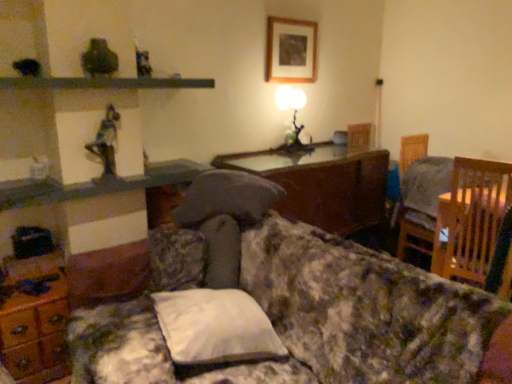
Question: Is metallic statue at upper left positioned with its back to wooden chair at right?

Choices:
 (A) yes
 (B) no

Answer: (B)

Question: Is the depth of metallic statue at upper left less than that of wooden chair at right?

Choices:
 (A) yes
 (B) no

Answer: (A)

Question: From the image's perspective, is metallic statue at upper left located above wooden chair at right?

Choices:
 (A) yes
 (B) no

Answer: (A)

Question: Is metallic statue at upper left further to the viewer compared to wooden chair at right?

Choices:
 (A) no
 (B) yes

Answer: (A)

Question: Could you tell me if metallic statue at upper left is turned towards wooden chair at right?

Choices:
 (A) yes
 (B) no

Answer: (B)

Question: Considering the relative sizes of metallic statue at upper left and wooden chair at right in the image provided, is metallic statue at upper left bigger than wooden chair at right?

Choices:
 (A) yes
 (B) no

Answer: (B)

Question: Is metallic gray shelf at upper center thinner than wooden picture frame at upper center?

Choices:
 (A) yes
 (B) no

Answer: (B)

Question: Is metallic gray shelf at upper center positioned far away from wooden picture frame at upper center?

Choices:
 (A) no
 (B) yes

Answer: (A)

Question: Considering the relative sizes of metallic gray shelf at upper center and wooden picture frame at upper center in the image provided, is metallic gray shelf at upper center smaller than wooden picture frame at upper center?

Choices:
 (A) no
 (B) yes

Answer: (A)

Question: Is metallic gray shelf at upper center facing towards wooden picture frame at upper center?

Choices:
 (A) yes
 (B) no

Answer: (B)

Question: Can you confirm if metallic gray shelf at upper center is positioned to the left of wooden picture frame at upper center?

Choices:
 (A) no
 (B) yes

Answer: (B)

Question: From the image's perspective, would you say metallic gray shelf at upper center is shown under wooden picture frame at upper center?

Choices:
 (A) no
 (B) yes

Answer: (B)

Question: Is wooden dresser at lower left surrounding floral fabric couch at center?

Choices:
 (A) yes
 (B) no

Answer: (B)